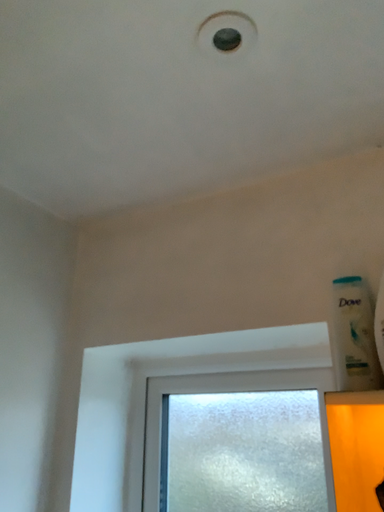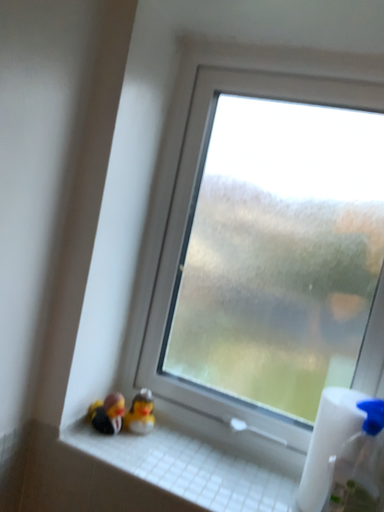
Question: Which way did the camera rotate in the video?

Choices:
 (A) rotated downward
 (B) rotated upward

Answer: (A)